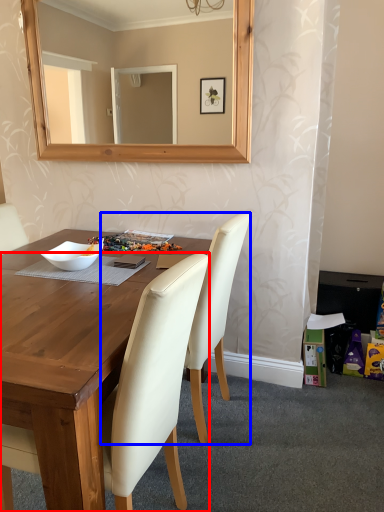
Question: Which point is further to the camera, chair (highlighted by a red box) or chair (highlighted by a blue box)?

Choices:
 (A) chair
 (B) chair

Answer: (B)